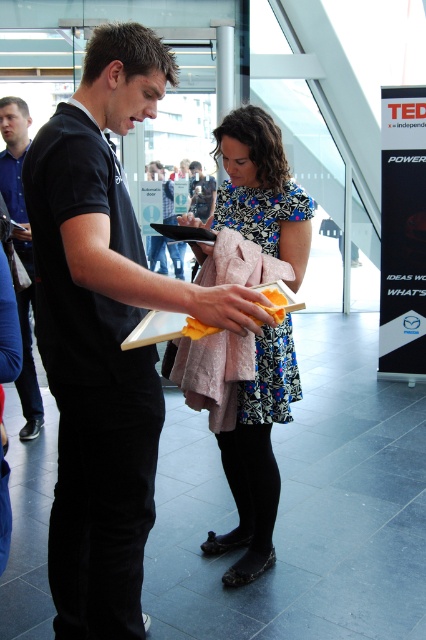
You are attending a TEDx event and notice two people at the center of the room. The man in the black matte shirt and the woman in the floral dress are standing close to each other. If you were to take a photo from the front, would the man in the black matte shirt at center completely block the view of the floral dress at center?

The black matte shirt at center has a greater height compared to floral dress at center. Since the man is taller, he might block part of the woman in the floral dress at center when viewed from the front, depending on their exact positioning and angles.

From the picture: You are attending a TEDx event and notice two people in the front. One is wearing a black matte shirt at center and the other a blue shirt at left. Which person is shorter?

The black matte shirt at center is not as tall as blue shirt at left, so the person in the black matte shirt at center is shorter.